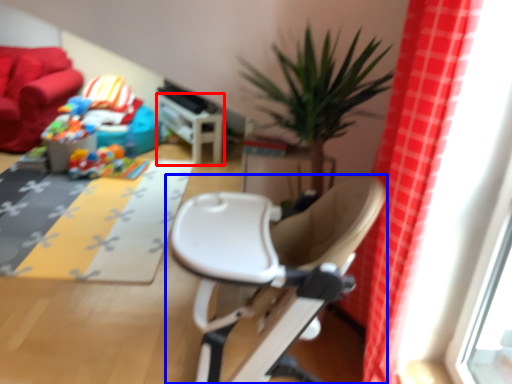
Question: Which object is closer to the camera taking this photo, table (highlighted by a red box) or chair (highlighted by a blue box)?

Choices:
 (A) table
 (B) chair

Answer: (B)